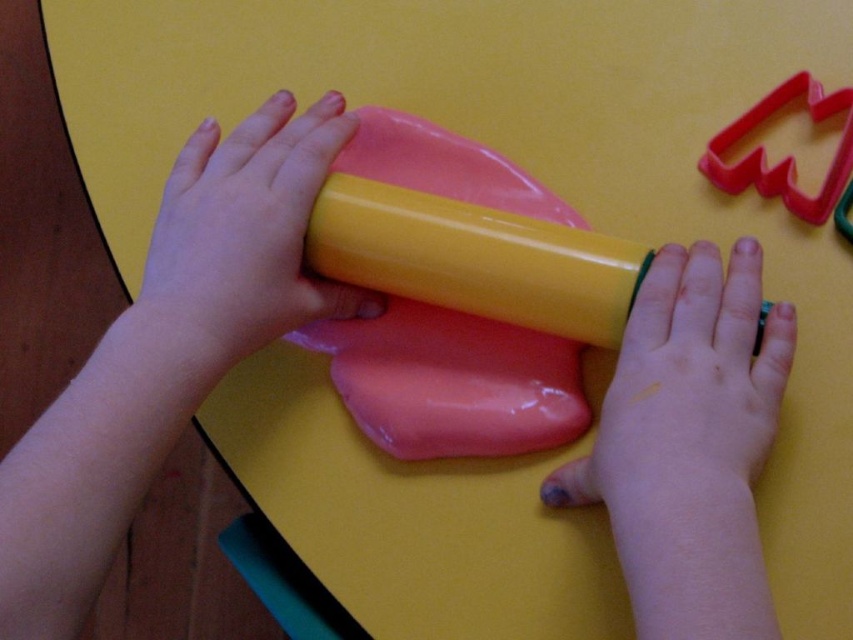
Question: Which point is closer to the camera taking this photo?

Choices:
 (A) (732, 468)
 (B) (534, 305)

Answer: (A)

Question: Among these points, which one is farthest from the camera?

Choices:
 (A) (181, 182)
 (B) (525, 273)
 (C) (738, 241)

Answer: (A)

Question: Is yellow matte hand at center to the right of yellow glossy rolling pin at center from the viewer's perspective?

Choices:
 (A) no
 (B) yes

Answer: (B)

Question: Which point is closer to the camera?

Choices:
 (A) yellow matte hand at center
 (B) smooth yellow rolling pin at center
 (C) yellow glossy rolling pin at center

Answer: (A)

Question: Is smooth yellow rolling pin at center closer to the viewer compared to yellow glossy rolling pin at center?

Choices:
 (A) yes
 (B) no

Answer: (A)

Question: Is yellow matte hand at center below yellow glossy rolling pin at center?

Choices:
 (A) no
 (B) yes

Answer: (B)